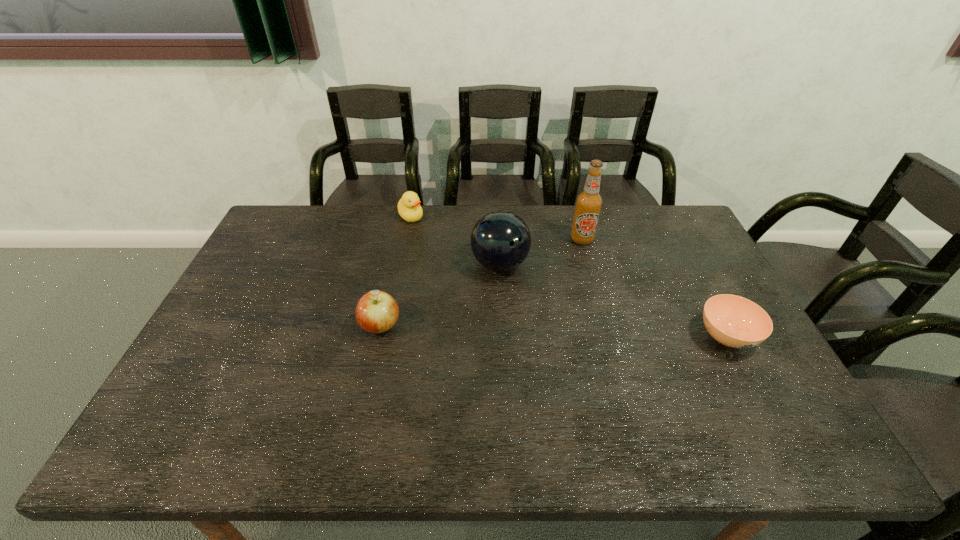
Locate an element on the screen. bowling ball present at the far edge is located at coordinates (500, 240).

Identify the location of duckling that is at the far edge. (409, 208).

This screenshot has height=540, width=960. I want to click on object located at the right edge, so click(x=734, y=321).

Locate an element on the screen. vacant space at the far edge of the desktop is located at coordinates (381, 211).

Identify the location of vacant space at the right edge. (762, 349).

This screenshot has height=540, width=960. I want to click on free location at the far left corner of the desktop, so click(x=291, y=220).

Identify the location of vacant space at the far right corner of the desktop. The image size is (960, 540). (666, 223).

Where is `empty space that is in between the shortest object and the apple`? The height and width of the screenshot is (540, 960). empty space that is in between the shortest object and the apple is located at coordinates (554, 332).

At what (x,y) coordinates should I click in order to perform the action: click on free point between the shortest object and the fourth shortest object. Please return your answer as a coordinate pair (x, y). Looking at the image, I should click on tap(613, 300).

You are a GUI agent. You are given a task and a screenshot of the screen. Output one action in this format:
    pyautogui.click(x=<x>, y=<y>)
    Task: Click on the unoccupied position between the rightmost object and the third object from left to right
    Image resolution: width=960 pixels, height=540 pixels.
    Given the screenshot: What is the action you would take?
    pyautogui.click(x=613, y=300)